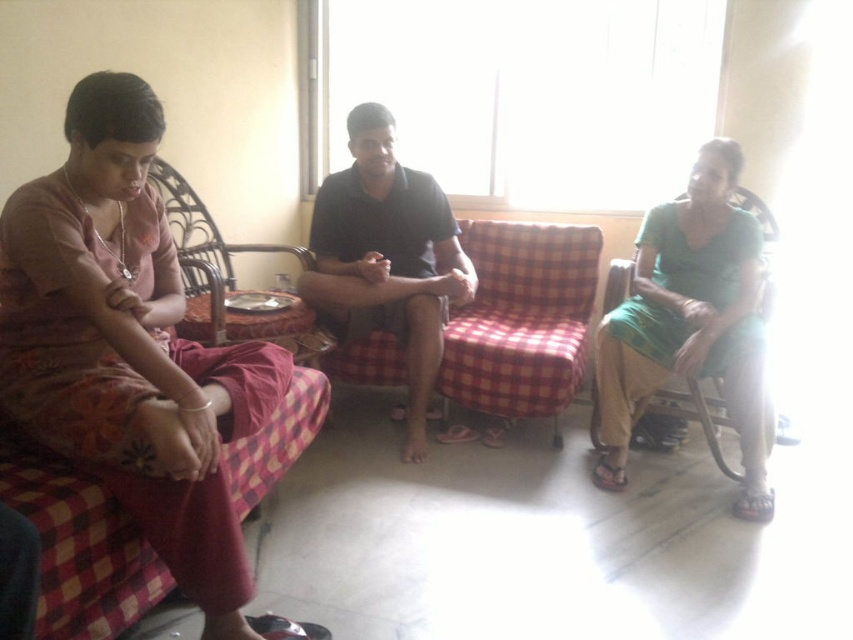
You are a delivery person who needs to place a package on the furniture. The package is 2 feet tall. Which furniture item, the red checkered fabric couch at center or the wicker chair at left, can safely hold the package without it toppling over?

The red checkered fabric couch at center has a greater height compared to wicker chair at left, so the package can be safely placed on the red checkered fabric couch at center as it is taller and more stable.

You are a delivery robot with a package that is 30 centimeters wide. You need to place it between the dark gray cotton shirt at center and the red checkered fabric couch at center. Is there enough space for the package?

The dark gray cotton shirt at center and red checkered fabric couch at center are 30.20 centimeters apart from each other. Since the package is 30 centimeters wide, there is just enough space to place it between them.